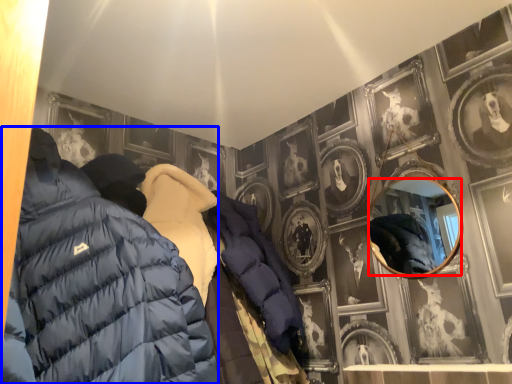
Question: Among these objects, which one is farthest to the camera, mirror (highlighted by a red box) or jacket (highlighted by a blue box)?

Choices:
 (A) mirror
 (B) jacket

Answer: (A)